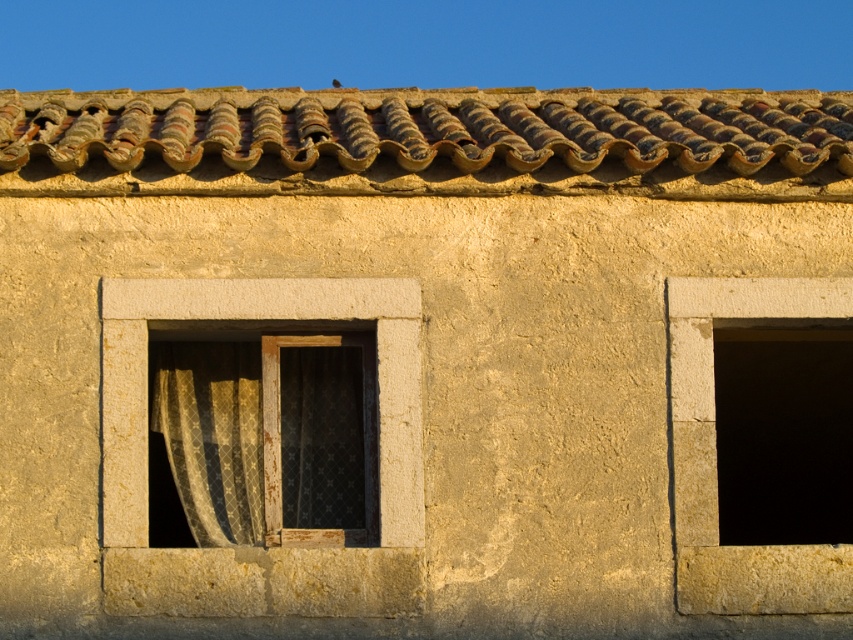
Question: Which of the following is the farthest from the observer?

Choices:
 (A) rusty clay tiles at top
 (B) smooth stone window at right
 (C) patterned fabric curtain at center-left
 (D) matte stone window at center left

Answer: (C)

Question: Is patterned fabric curtain at center-left further to camera compared to smooth stone window at right?

Choices:
 (A) no
 (B) yes

Answer: (B)

Question: Can you confirm if patterned fabric curtain at center-left is positioned below matte stone window at center left?

Choices:
 (A) no
 (B) yes

Answer: (B)

Question: Which of these objects is positioned closest to the rusty clay tiles at top?

Choices:
 (A) matte stone window at center left
 (B) patterned fabric curtain at center-left

Answer: (A)

Question: Does patterned fabric curtain at center-left have a lesser width compared to matte stone window at center left?

Choices:
 (A) yes
 (B) no

Answer: (A)

Question: Estimate the real-world distances between objects in this image. Which object is farther from the smooth stone window at right?

Choices:
 (A) patterned fabric curtain at center-left
 (B) rusty clay tiles at top

Answer: (A)